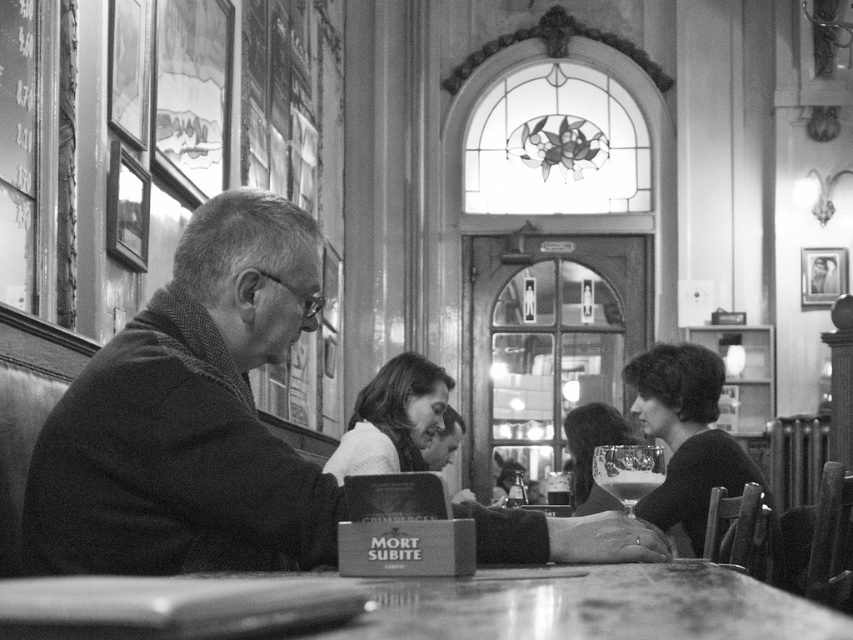
Based on the scene description, where is the smooth wool coat at left located in the image?

The smooth wool coat at left is located at point 2D coordinates of [190,417].